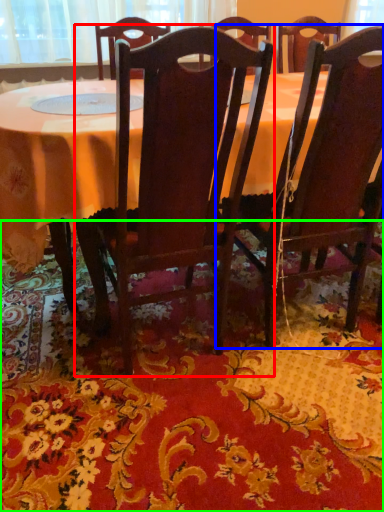
Question: Based on their relative distances, which object is nearer to chair (highlighted by a red box)? Choose from chair (highlighted by a blue box) and mat (highlighted by a green box).

Choices:
 (A) chair
 (B) mat

Answer: (A)